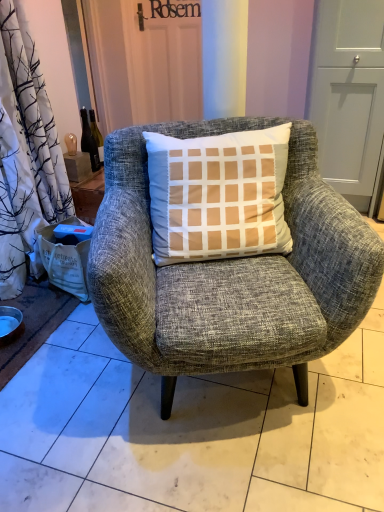
You are a GUI agent. You are given a task and a screenshot of the screen. Output one action in this format:
    pyautogui.click(x=<x>, y=<y>)
    Task: Click on the vacant space to the right of matte silver bowl at lower left
    The width and height of the screenshot is (384, 512).
    Given the screenshot: What is the action you would take?
    pyautogui.click(x=40, y=329)